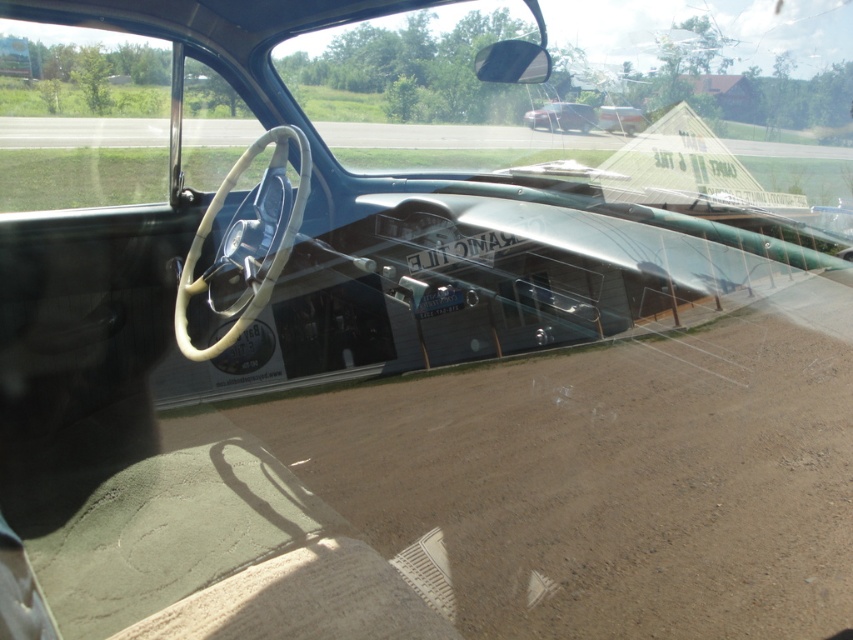
In the scene shown: You are sitting in the driver seat of the vintage vehicle and want to reach the point at coordinates point (650, 609) on the windshield. Can you safely reach it without stretching too far?

The point (650, 609) is 3.14 meters away from viewer, so it might be difficult to reach without stretching too far since it is quite far from the driver seat.